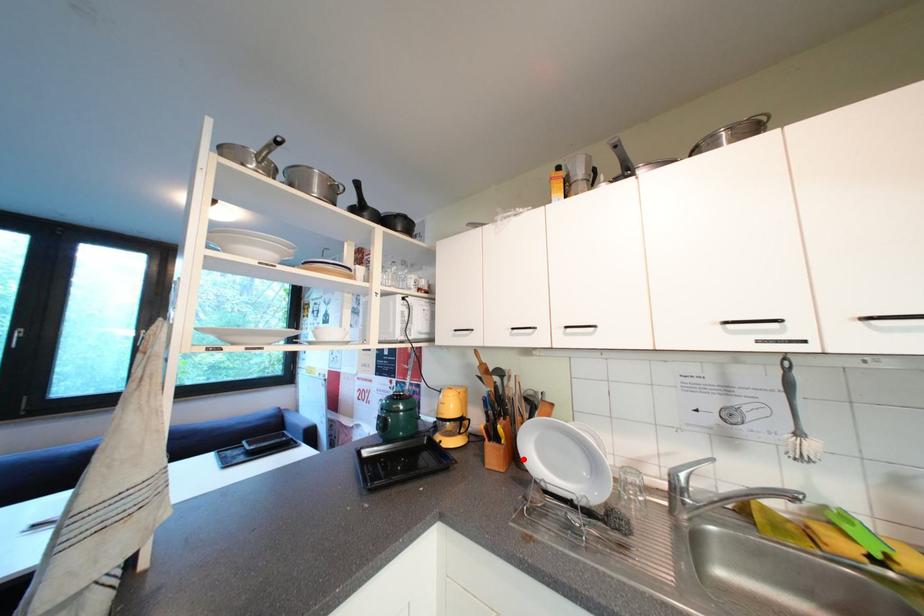
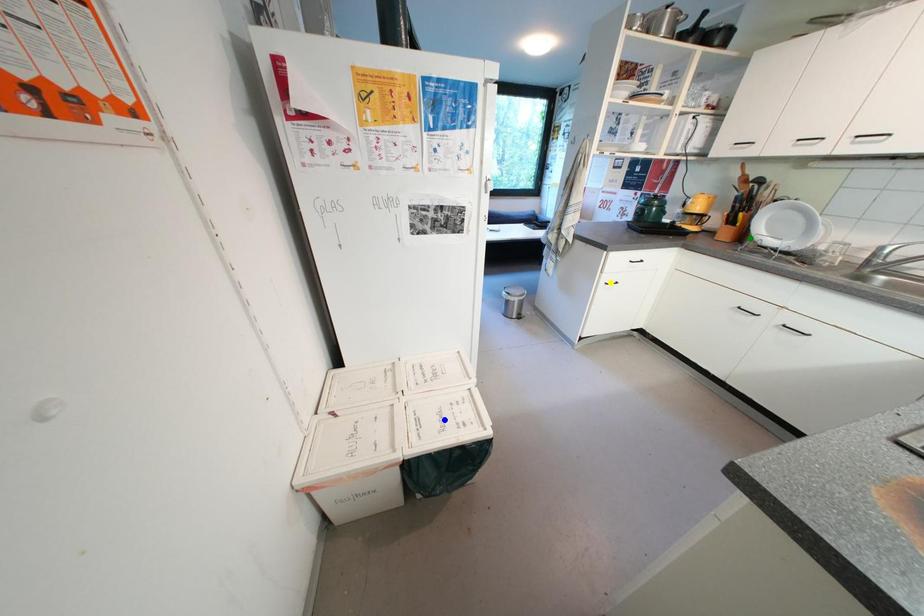
Question: I am providing you with two images of the same scene from different viewpoints. A red point is marked on the first image. You are given multiple points on the second image. Which spot in image 2 lines up with the point in image 1?

Choices:
 (A) yellow point
 (B) green point
 (C) blue point

Answer: (B)